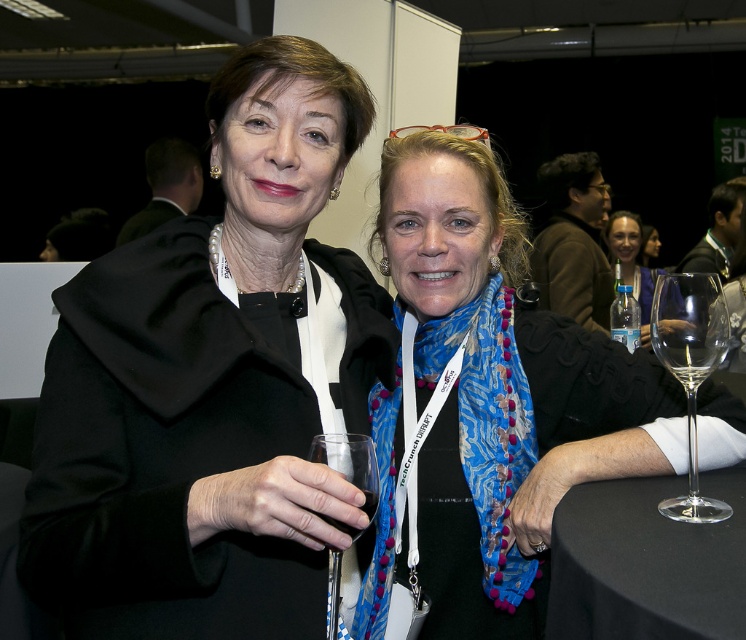
Question: Is black matte coat at upper left smaller than clear glass wine at right?

Choices:
 (A) yes
 (B) no

Answer: (B)

Question: Does black matte coat at upper left appear under blue silk scarf at center?

Choices:
 (A) no
 (B) yes

Answer: (A)

Question: Considering the relative positions of clear glass wine at right and transparent glass at lower center in the image provided, where is clear glass wine at right located with respect to transparent glass at lower center?

Choices:
 (A) above
 (B) below

Answer: (A)

Question: Among these objects, which one is nearest to the camera?

Choices:
 (A) transparent glass wine glass at right
 (B) blue silk scarf at center

Answer: (A)

Question: Which of the following is the closest to the observer?

Choices:
 (A) translucent plastic water bottle at upper right
 (B) clear glass wine glass at center
 (C) black fabric table at lower right

Answer: (C)

Question: Which of the following is the closest to the observer?

Choices:
 (A) (351, 467)
 (B) (366, 500)
 (C) (386, 141)
 (D) (624, 252)

Answer: (B)